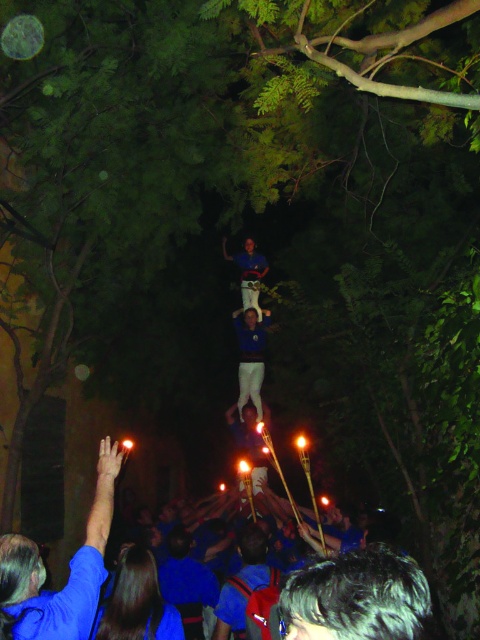
Question: Which object appears farthest from the camera in this image?

Choices:
 (A) blue fabric shirt at center
 (B) blue fabric hand at lower left

Answer: (A)

Question: Is blue fabric hand at lower left above blue fabric shirt at center?

Choices:
 (A) no
 (B) yes

Answer: (A)

Question: Can you confirm if blue fabric hand at lower left is positioned above blue fabric shirt at center?

Choices:
 (A) yes
 (B) no

Answer: (B)

Question: Among these points, which one is farthest from the camera?

Choices:
 (A) (76, 620)
 (B) (242, 266)

Answer: (B)

Question: Is blue fabric hand at lower left to the left of blue fabric shirt at center from the viewer's perspective?

Choices:
 (A) yes
 (B) no

Answer: (A)